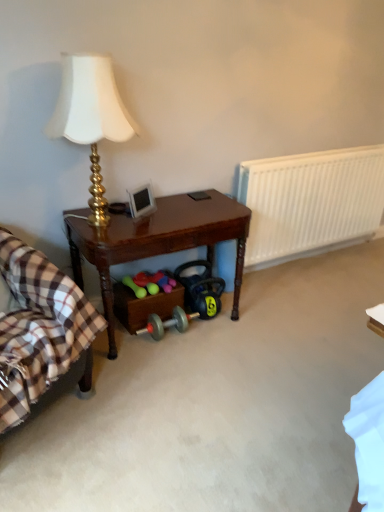
Where is `gold metallic lamp at upper left`? The width and height of the screenshot is (384, 512). gold metallic lamp at upper left is located at coordinates (91, 117).

At what (x,y) coordinates should I click in order to perform the action: click on white plastic radiator at right. Please return your answer as a coordinate pair (x, y). Looking at the image, I should click on (311, 200).

The width and height of the screenshot is (384, 512). In order to click on plaid fabric at left in this screenshot , I will do tap(39, 326).

What do you see at coordinates (158, 241) in the screenshot?
I see `brown wooden table at center` at bounding box center [158, 241].

Identify the location of gold metallic lamp at upper left. (91, 117).

From a real-world perspective, is brown wooden table at center on plaid fabric at left?

Actually, brown wooden table at center is physically below plaid fabric at left in the real world.

Between brown wooden table at center and plaid fabric at left, which one has larger size?

Bigger between the two is plaid fabric at left.

Is brown wooden table at center placed right next to plaid fabric at left?

No, brown wooden table at center is not with plaid fabric at left.

Is brown wooden table at center wider than plaid fabric at left?

No, brown wooden table at center is not wider than plaid fabric at left.

From a real-world perspective, is plaid fabric at left physically above white plastic radiator at right?

No, from a real-world perspective, plaid fabric at left is not above white plastic radiator at right.

Which is more to the left, plaid fabric at left or white plastic radiator at right?

Positioned to the left is plaid fabric at left.

Can you confirm if plaid fabric at left is smaller than white plastic radiator at right?

Actually, plaid fabric at left might be larger than white plastic radiator at right.

From the picture: From a real-world perspective, which is physically above, white plastic radiator at right or plaid fabric at left?

white plastic radiator at right is physically above.

Is white plastic radiator at right oriented away from plaid fabric at left?

No, white plastic radiator at right is not facing away from plaid fabric at left.

Considering the relative sizes of white plastic radiator at right and plaid fabric at left in the image provided, is white plastic radiator at right smaller than plaid fabric at left?

Yes, white plastic radiator at right is smaller than plaid fabric at left.

In the scene shown: Is the position of white plastic radiator at right more distant than that of plaid fabric at left?

Yes.

Considering the positions of points (97, 170) and (32, 275), is point (97, 170) closer to camera compared to point (32, 275)?

No, (97, 170) is behind (32, 275).

Between gold metallic lamp at upper left and plaid fabric at left, which one appears on the right side from the viewer's perspective?

gold metallic lamp at upper left is more to the right.

From a real-world perspective, is gold metallic lamp at upper left on top of plaid fabric at left?

Yes.

In order to click on lamp above the white plastic radiator at right (from the image's perspective) in this screenshot , I will do (91, 117).

Does white plastic radiator at right have a lesser height compared to gold metallic lamp at upper left?

Yes.

Does white plastic radiator at right have a greater width compared to gold metallic lamp at upper left?

Incorrect, the width of white plastic radiator at right does not surpass that of gold metallic lamp at upper left.

Which is more to the left, gold metallic lamp at upper left or white plastic radiator at right?

Positioned to the left is gold metallic lamp at upper left.

Does gold metallic lamp at upper left touch white plastic radiator at right?

gold metallic lamp at upper left and white plastic radiator at right are not in contact.

From the image's perspective, is gold metallic lamp at upper left beneath white plastic radiator at right?

No.

Would you say plaid fabric at left contains gold metallic lamp at upper left?

No.

From a real-world perspective, who is located lower, plaid fabric at left or gold metallic lamp at upper left?

From a 3D spatial view, plaid fabric at left is below.

Consider the image. Does plaid fabric at left have a lesser width compared to gold metallic lamp at upper left?

In fact, plaid fabric at left might be wider than gold metallic lamp at upper left.

Which is behind, point (41, 320) or point (94, 206)?

Positioned behind is point (94, 206).

Where is `table behind the plaid fabric at left`? The image size is (384, 512). table behind the plaid fabric at left is located at coordinates (158, 241).

At what (x,y) coordinates should I click in order to perform the action: click on radiator on the right of plaid fabric at left. Please return your answer as a coordinate pair (x, y). Looking at the image, I should click on [x=311, y=200].

Which object lies further to the anchor point gold metallic lamp at upper left, brown wooden table at center or white plastic radiator at right?

The object further to gold metallic lamp at upper left is white plastic radiator at right.

From the image, which object appears to be nearer to plaid fabric at left, gold metallic lamp at upper left or brown wooden table at center?

Based on the image, brown wooden table at center appears to be nearer to plaid fabric at left.

Which object lies further to the anchor point gold metallic lamp at upper left, plaid fabric at left or brown wooden table at center?

plaid fabric at left lies further to gold metallic lamp at upper left than the other object.

Based on their spatial positions, is plaid fabric at left or white plastic radiator at right further from gold metallic lamp at upper left?

white plastic radiator at right lies further to gold metallic lamp at upper left than the other object.

Which object lies further to the anchor point white plastic radiator at right, plaid fabric at left or brown wooden table at center?

plaid fabric at left is further to white plastic radiator at right.

From the image, which object appears to be nearer to plaid fabric at left, brown wooden table at center or white plastic radiator at right?

brown wooden table at center is positioned closer to the anchor plaid fabric at left.

Looking at the image, which one is located further to plaid fabric at left, white plastic radiator at right or brown wooden table at center?

white plastic radiator at right lies further to plaid fabric at left than the other object.

When comparing their distances from white plastic radiator at right, does brown wooden table at center or gold metallic lamp at upper left seem closer?

brown wooden table at center is closer to white plastic radiator at right.

The width and height of the screenshot is (384, 512). In order to click on lamp between plaid fabric at left and white plastic radiator at right from left to right in this screenshot , I will do `click(91, 117)`.

Find the location of a particular element. table between plaid fabric at left and white plastic radiator at right from left to right is located at coordinates (158, 241).

Identify the location of table that lies between gold metallic lamp at upper left and plaid fabric at left from top to bottom. (158, 241).

Where is `table between gold metallic lamp at upper left and white plastic radiator at right from left to right`? The height and width of the screenshot is (512, 384). table between gold metallic lamp at upper left and white plastic radiator at right from left to right is located at coordinates (158, 241).